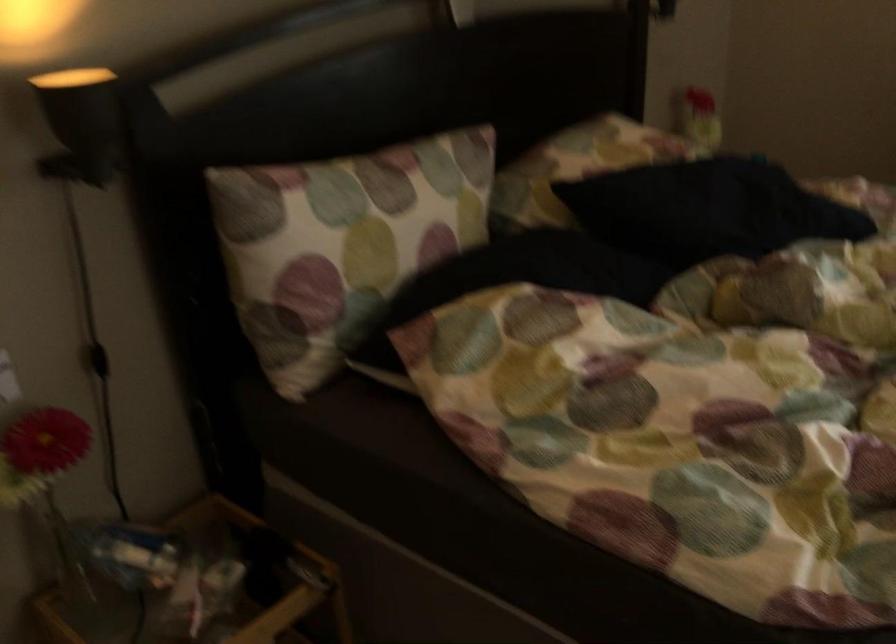
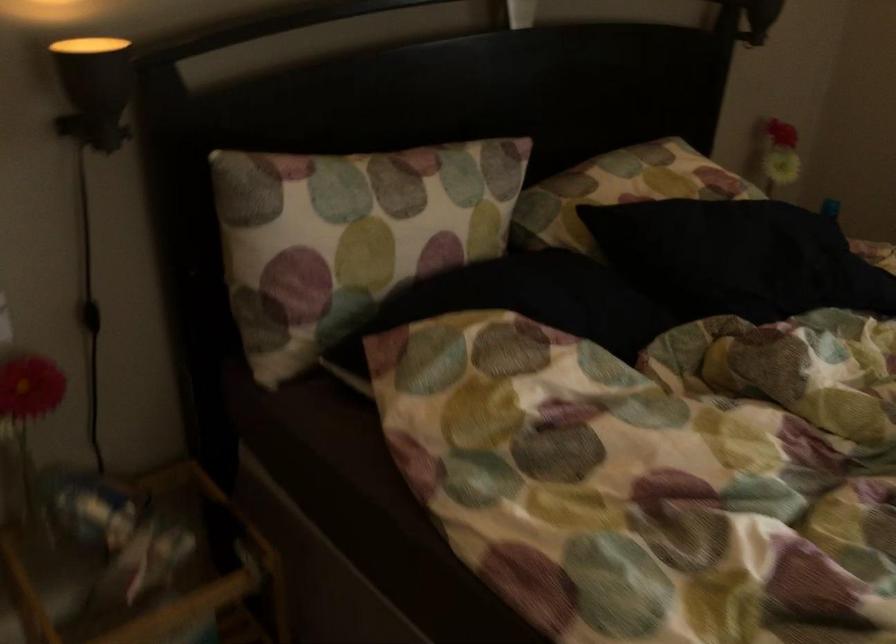
The point at (365, 205) is marked in the first image. Where is the corresponding point in the second image?

(367, 207)